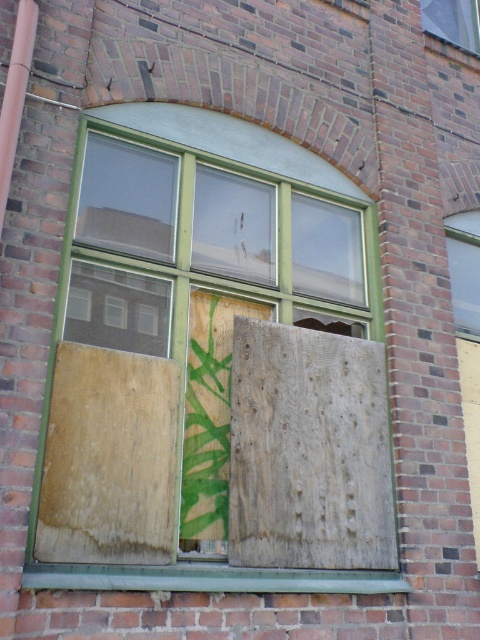
You are a painter trying to touch up the green painted wood at center and the wooden board at right. You have a ladder that is 3 feet long. Can you reach both areas without moving the ladder?

The green painted wood at center is 3.69 feet from the wooden board at right, which is longer than the ladder length of 3 feet. Therefore, you cannot reach both areas without moving the ladder.

You are standing in front of the brick building and notice the wooden board at right and the clear glass window at upper center. Which object is positioned to the left of the other?

The wooden board at right is to the left of the clear glass window at upper center.